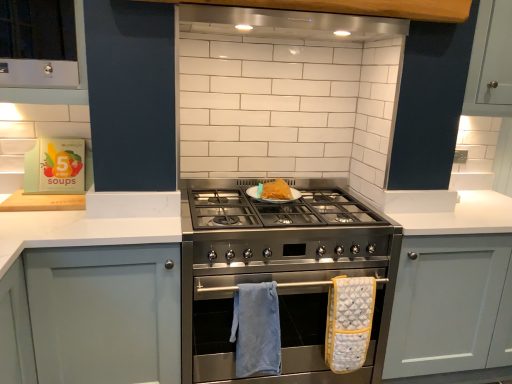
Image resolution: width=512 pixels, height=384 pixels. Identify the location of stainless steel stove at center. (279, 273).

What do you see at coordinates (256, 329) in the screenshot?
I see `blue soft towel at lower center, the first bath towel from the left` at bounding box center [256, 329].

Looking at this image, in order to face yellow quilted oven mitt at center, marked as the 1th bath towel in a right-to-left arrangement, should I rotate leftwards or rightwards?

Rotate right and turn 12.573 degrees.

This screenshot has height=384, width=512. I want to click on matte gray cabinet at center, which is counted as the 1th cabinetry, starting from the right, so click(445, 303).

What is the approximate width of white matte cabinet at left, which is the 1th cabinetry in left-to-right order?

white matte cabinet at left, which is the 1th cabinetry in left-to-right order, is 62.97 centimeters in width.

Measure the distance between white matte cabinet at left, which is the 1th cabinetry in left-to-right order, and camera.

A distance of 1.50 meters exists between white matte cabinet at left, which is the 1th cabinetry in left-to-right order, and camera.

This screenshot has height=384, width=512. Identify the location of stainless steel stove at center. (279, 273).

How many degrees apart are the facing directions of white matte cabinet at left, which is the second cabinetry in right-to-left order, and stainless steel stove at center?

The angle between the facing direction of white matte cabinet at left, which is the second cabinetry in right-to-left order, and the facing direction of stainless steel stove at center is 0.21 degrees.

Considering the sizes of white matte cabinet at left, which is the 1th cabinetry in left-to-right order, and stainless steel stove at center in the image, is white matte cabinet at left, which is the 1th cabinetry in left-to-right order, taller or shorter than stainless steel stove at center?

Clearly, white matte cabinet at left, which is the 1th cabinetry in left-to-right order, is shorter compared to stainless steel stove at center.

In the image, is white matte cabinet at left, which is the 1th cabinetry in left-to-right order, positioned in front of or behind stainless steel stove at center?

Clearly, white matte cabinet at left, which is the 1th cabinetry in left-to-right order, is in front of stainless steel stove at center.

Is point (162, 244) closer or farther from the camera than point (274, 217)?

Clearly, point (162, 244) is closer to the camera than point (274, 217).

Relative to white matte cabinet at left, which is the 1th cabinetry in left-to-right order, is stainless steel stove at center in front or behind?

stainless steel stove at center is positioned farther from the viewer than white matte cabinet at left, which is the 1th cabinetry in left-to-right order.

Considering the relative sizes of stainless steel stove at center and white matte cabinet at left, which is the second cabinetry in right-to-left order, in the image provided, is stainless steel stove at center thinner than white matte cabinet at left, which is the second cabinetry in right-to-left order,?

No.

Is point (301, 218) closer or farther from the camera than point (83, 261)?

Point (301, 218) appears to be farther away from the viewer than point (83, 261).

Would you say stainless steel stove at center is outside white matte cabinet at left, which is the second cabinetry in right-to-left order?

Yes, stainless steel stove at center is located beyond the bounds of white matte cabinet at left, which is the second cabinetry in right-to-left order.

Image resolution: width=512 pixels, height=384 pixels. In order to click on the 1st bath towel behind the stainless steel stove at center in this screenshot , I will do `click(256, 329)`.

Could you tell me if stainless steel stove at center is turned towards blue soft towel at lower center, which is the second bath towel from right to left?

Yes, stainless steel stove at center is facing blue soft towel at lower center, which is the second bath towel from right to left.

From the image's perspective, is stainless steel stove at center positioned above or below blue soft towel at lower center, the first bath towel from the left?

From the image's perspective, stainless steel stove at center appears above blue soft towel at lower center, the first bath towel from the left.

Is stainless steel stove at center outside of blue soft towel at lower center, the first bath towel from the left?

That's correct, stainless steel stove at center is outside of blue soft towel at lower center, the first bath towel from the left.

The image size is (512, 384). Identify the location of cabinetry that is the 1st one when counting downward from the golden brown pastry at center (from the image's perspective). (445, 303).

Considering the relative sizes of matte gray cabinet at center, marked as the 2th cabinetry in a left-to-right arrangement, and golden brown pastry at center in the image provided, is matte gray cabinet at center, marked as the 2th cabinetry in a left-to-right arrangement, shorter than golden brown pastry at center?

In fact, matte gray cabinet at center, marked as the 2th cabinetry in a left-to-right arrangement, may be taller than golden brown pastry at center.

Does matte gray cabinet at center, which is counted as the 1th cabinetry, starting from the right, contain golden brown pastry at center?

No.

Considering the relative positions of matte gray cabinet at center, which is counted as the 1th cabinetry, starting from the right, and golden brown pastry at center in the image provided, is matte gray cabinet at center, which is counted as the 1th cabinetry, starting from the right, to the left of golden brown pastry at center from the viewer's perspective?

No.

Where is `the 2nd bath towel below the stainless steel stove at center (from a real-world perspective)`? This screenshot has width=512, height=384. the 2nd bath towel below the stainless steel stove at center (from a real-world perspective) is located at coordinates (349, 322).

In terms of size, does stainless steel stove at center appear bigger or smaller than yellow quilted oven mitt at center, which is the second bath towel from left to right?

Clearly, stainless steel stove at center is larger in size than yellow quilted oven mitt at center, which is the second bath towel from left to right.

Does stainless steel stove at center have a lesser width compared to yellow quilted oven mitt at center, which is the second bath towel from left to right?

No, stainless steel stove at center is not thinner than yellow quilted oven mitt at center, which is the second bath towel from left to right.

Is stainless steel stove at center turned away from yellow quilted oven mitt at center, marked as the 1th bath towel in a right-to-left arrangement?

stainless steel stove at center does not have its back to yellow quilted oven mitt at center, marked as the 1th bath towel in a right-to-left arrangement.

Can you confirm if stainless steel exhaust hood at upper center is positioned to the left of yellow quilted oven mitt at center, marked as the 1th bath towel in a right-to-left arrangement?

Yes, stainless steel exhaust hood at upper center is to the left of yellow quilted oven mitt at center, marked as the 1th bath towel in a right-to-left arrangement.

From a real-world perspective, which object rests below the other?

yellow quilted oven mitt at center, marked as the 1th bath towel in a right-to-left arrangement, from a real-world perspective.

Where is `the 2nd bath towel behind when counting from the stainless steel exhaust hood at upper center`? the 2nd bath towel behind when counting from the stainless steel exhaust hood at upper center is located at coordinates pyautogui.click(x=349, y=322).

Based on the photo, is stainless steel exhaust hood at upper center taller or shorter than yellow quilted oven mitt at center, which is the second bath towel from left to right?

stainless steel exhaust hood at upper center is shorter than yellow quilted oven mitt at center, which is the second bath towel from left to right.

Is yellow quilted oven mitt at center, which is the second bath towel from left to right, further to camera compared to blue soft towel at lower center, which is the second bath towel from right to left?

Yes, yellow quilted oven mitt at center, which is the second bath towel from left to right, is further from the camera.

Is yellow quilted oven mitt at center, marked as the 1th bath towel in a right-to-left arrangement, located outside blue soft towel at lower center, which is the second bath towel from right to left?

Yes, yellow quilted oven mitt at center, marked as the 1th bath towel in a right-to-left arrangement, is not within blue soft towel at lower center, which is the second bath towel from right to left.

Between yellow quilted oven mitt at center, which is the second bath towel from left to right, and blue soft towel at lower center, which is the second bath towel from right to left, which one has smaller size?

Smaller between the two is yellow quilted oven mitt at center, which is the second bath towel from left to right.

Is yellow quilted oven mitt at center, marked as the 1th bath towel in a right-to-left arrangement, at the right side of blue soft towel at lower center, which is the second bath towel from right to left?

Correct, you'll find yellow quilted oven mitt at center, marked as the 1th bath towel in a right-to-left arrangement, to the right of blue soft towel at lower center, which is the second bath towel from right to left.

Identify the location of appliance lying above the white matte cabinet at left, which is the second cabinetry in right-to-left order (from the image's perspective). (279, 273).

Where is `cabinetry on the left of stainless steel stove at center`? This screenshot has height=384, width=512. cabinetry on the left of stainless steel stove at center is located at coordinates (105, 313).

When comparing their distances from stainless steel exhaust hood at upper center, does white matte cabinet at left, which is the 1th cabinetry in left-to-right order, or matte gray cabinet at center, which is counted as the 1th cabinetry, starting from the right, seem closer?

Among the two, matte gray cabinet at center, which is counted as the 1th cabinetry, starting from the right, is located nearer to stainless steel exhaust hood at upper center.

From the image, which object appears to be nearer to golden brown pastry at center, white matte cabinet at left, which is the second cabinetry in right-to-left order, or stainless steel exhaust hood at upper center?

stainless steel exhaust hood at upper center.

When comparing their distances from golden brown pastry at center, does white matte cabinet at left, which is the second cabinetry in right-to-left order, or blue soft towel at lower center, which is the second bath towel from right to left, seem further?

white matte cabinet at left, which is the second cabinetry in right-to-left order.

Which object lies nearer to the anchor point stainless steel exhaust hood at upper center, white matte cabinet at left, which is the 1th cabinetry in left-to-right order, or golden brown pastry at center?

The object closer to stainless steel exhaust hood at upper center is golden brown pastry at center.

Considering their positions, is stainless steel exhaust hood at upper center positioned further to blue soft towel at lower center, the first bath towel from the left, than golden brown pastry at center?

Based on the image, stainless steel exhaust hood at upper center appears to be further to blue soft towel at lower center, the first bath towel from the left.

Which object lies further to the anchor point stainless steel exhaust hood at upper center, stainless steel stove at center or white matte cabinet at left, which is the second cabinetry in right-to-left order?

Among the two, white matte cabinet at left, which is the second cabinetry in right-to-left order, is located further to stainless steel exhaust hood at upper center.

Estimate the real-world distances between objects in this image. Which object is further from stainless steel exhaust hood at upper center, stainless steel stove at center or golden brown pastry at center?

stainless steel stove at center.

Estimate the real-world distances between objects in this image. Which object is further from golden brown pastry at center, matte gray cabinet at center, which is counted as the 1th cabinetry, starting from the right, or white matte cabinet at left, which is the 1th cabinetry in left-to-right order?

Based on the image, matte gray cabinet at center, which is counted as the 1th cabinetry, starting from the right, appears to be further to golden brown pastry at center.

Locate an element on the screen. food that lies between stainless steel exhaust hood at upper center and yellow quilted oven mitt at center, marked as the 1th bath towel in a right-to-left arrangement, from top to bottom is located at coordinates (276, 190).

Where is `food between stainless steel exhaust hood at upper center and matte gray cabinet at center, which is counted as the 1th cabinetry, starting from the right, in the vertical direction`? This screenshot has height=384, width=512. food between stainless steel exhaust hood at upper center and matte gray cabinet at center, which is counted as the 1th cabinetry, starting from the right, in the vertical direction is located at coordinates [276, 190].

Find the location of `food between stainless steel stove at center and matte gray cabinet at center, marked as the 2th cabinetry in a left-to-right arrangement, in the horizontal direction`. food between stainless steel stove at center and matte gray cabinet at center, marked as the 2th cabinetry in a left-to-right arrangement, in the horizontal direction is located at coordinates (276, 190).

Find the location of a particular element. Image resolution: width=512 pixels, height=384 pixels. appliance between blue soft towel at lower center, the first bath towel from the left, and matte gray cabinet at center, marked as the 2th cabinetry in a left-to-right arrangement is located at coordinates (279, 273).